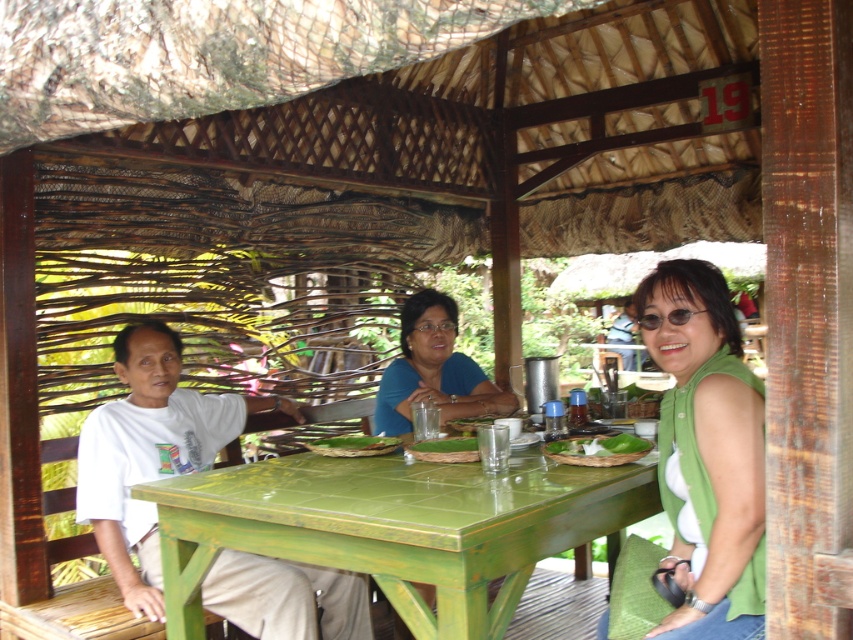
You are a server at this rustic dining area. You need to place a large platter of food on the table. Which object, the green painted wood table at center or the green woven mat at table, is the correct surface to place the platter?

The green painted wood table at center is much taller than the green woven mat at table, so the platter should be placed on the green painted wood table at center as it is the proper surface for serving food.

You are a server at this rustic dining area and need to place a new drink order on the table. Since there are already items on the table, you want to ensure you place the drink on the green painted wood table at center without it overlapping the green woven mat at table. Based on their positions, where should you place the drink?

The green painted wood table at center is positioned on the left side of the green woven mat at table. Therefore, placing the drink on the right side of the green woven mat at table would keep it on the green painted wood table at center and avoid overlapping the mat.

You are planning to place a large salad bowl on the table. The salad bowl is bigger than the green leafy vegetable at table center. Will the green woven mat at table be able to accommodate the salad bowl?

The green leafy vegetable at table center is larger than the green woven mat at table. Since the salad bowl is bigger than the green leafy vegetable at table center, it will not fit on the green woven mat at table.